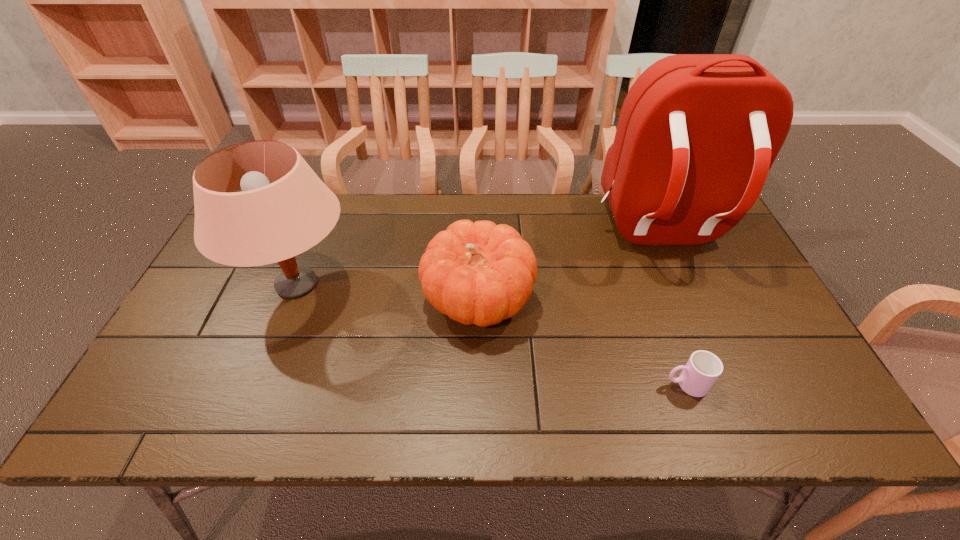
Where is `vacant space at the left edge of the desktop`? The width and height of the screenshot is (960, 540). vacant space at the left edge of the desktop is located at coordinates (234, 298).

This screenshot has width=960, height=540. In the image, there is a desktop. Find the location of `vacant area at the right edge`. vacant area at the right edge is located at coordinates (754, 377).

This screenshot has height=540, width=960. Find the location of `blank space at the near left corner of the desktop`. blank space at the near left corner of the desktop is located at coordinates (184, 422).

Where is `free location at the near right corner`? This screenshot has width=960, height=540. free location at the near right corner is located at coordinates (800, 425).

You are a GUI agent. You are given a task and a screenshot of the screen. Output one action in this format:
    pyautogui.click(x=<x>, y=<y>)
    Task: Click on the free spot between the pumpkin and the third shortest object
    
    Given the screenshot: What is the action you would take?
    pyautogui.click(x=388, y=292)

This screenshot has height=540, width=960. I want to click on unoccupied area between the shortest object and the second shortest object, so click(582, 342).

The image size is (960, 540). I want to click on vacant space in between the backpack and the nearest object, so click(x=673, y=308).

Identify the location of free area in between the second object from left to right and the second tallest object. This screenshot has height=540, width=960. (388, 292).

At what (x,y) coordinates should I click in order to perform the action: click on unoccupied area between the shortest object and the third tallest object. Please return your answer as a coordinate pair (x, y). Image resolution: width=960 pixels, height=540 pixels. Looking at the image, I should click on (582, 342).

You are a GUI agent. You are given a task and a screenshot of the screen. Output one action in this format:
    pyautogui.click(x=<x>, y=<y>)
    Task: Click on the free space that is in between the tallest object and the nearest object
    Image resolution: width=960 pixels, height=540 pixels.
    Given the screenshot: What is the action you would take?
    pyautogui.click(x=673, y=308)